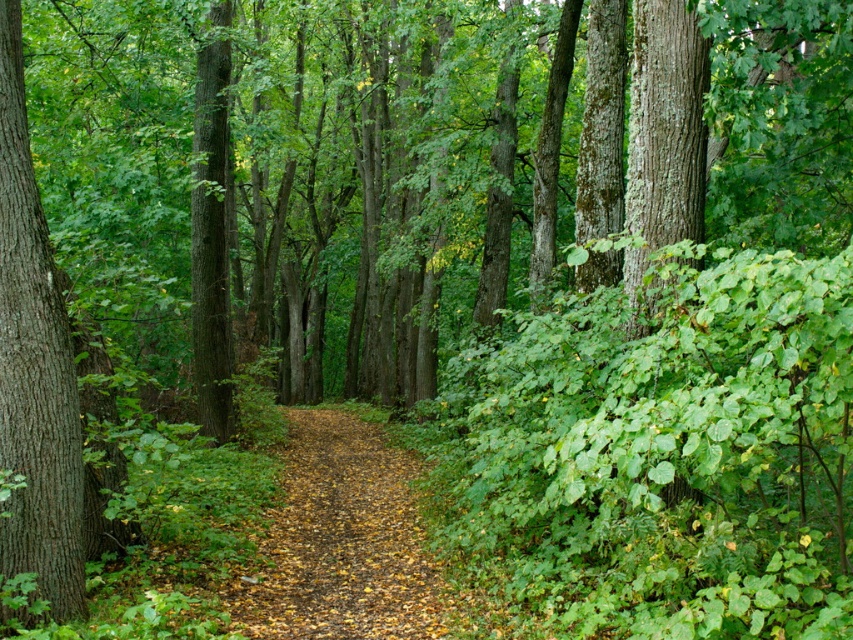
Question: Which point appears farthest from the camera in this image?

Choices:
 (A) (18, 12)
 (B) (297, 468)

Answer: (B)

Question: Does yellow leafy path at center appear over brown rough bark tree at left?

Choices:
 (A) yes
 (B) no

Answer: (B)

Question: Does yellow leafy path at center have a larger size compared to brown rough bark tree at left?

Choices:
 (A) yes
 (B) no

Answer: (A)

Question: Does yellow leafy path at center appear under brown rough bark tree at left?

Choices:
 (A) no
 (B) yes

Answer: (B)